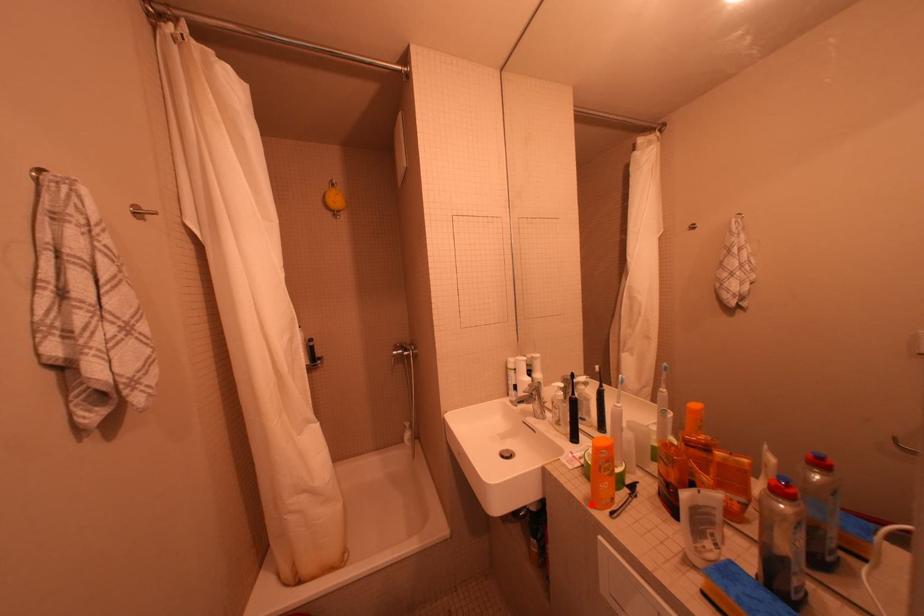
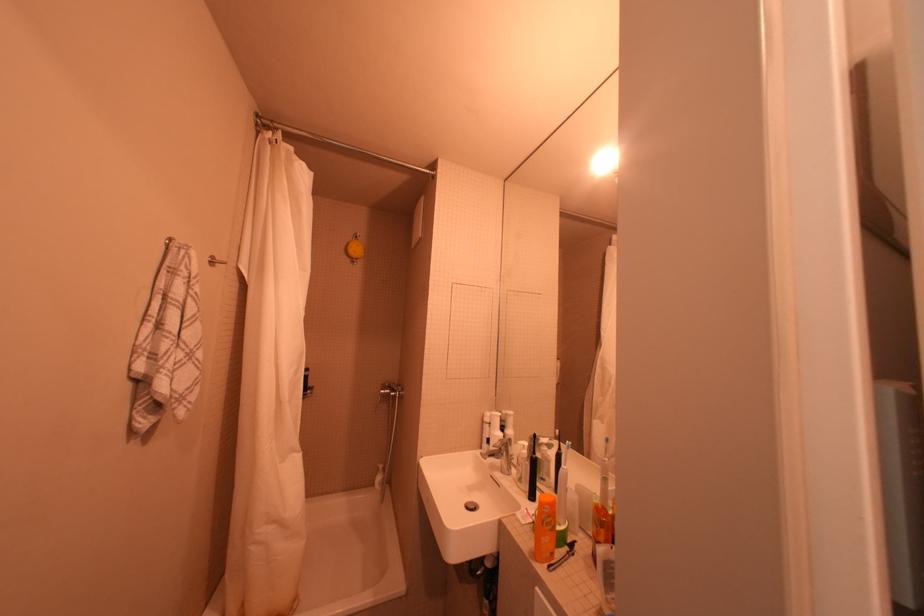
In the second image, find the point that corresponds to the highlighted location in the first image.

(536, 557)